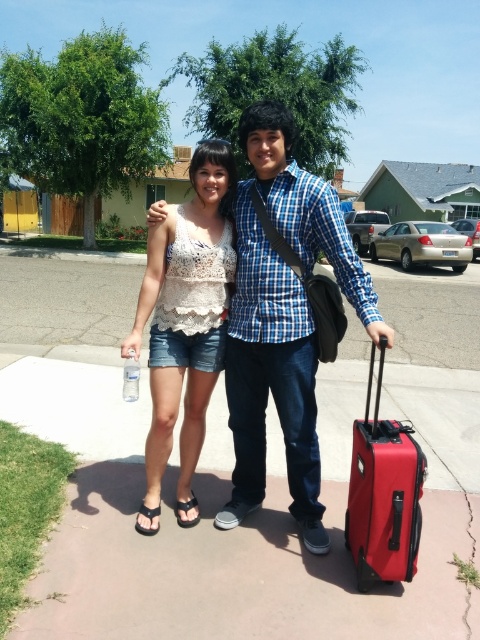
You are a photographer trying to capture a photo of the white lace tank top at center and the black fabric sandal at lower left. Which object should you focus on first if you want to ensure both are in the frame without moving the camera?

The black fabric sandal at lower left should be focused on first because the white lace tank top at center is to the right of it, so adjusting the frame to include the sandal on the left ensures the tank top is also within the shot.

You are a delivery robot with a width of 50 centimeters. You need to move past the clear plastic bottle at lower left and the black fabric sandal at lower left. Can you fit through the space between them?

The space between the clear plastic bottle at lower left and the black fabric sandal at lower left is 64.22 centimeters. Since your width is 50 centimeters, you can fit through the space between them.

Based on the photo, you are standing at the center of the image and want to pick up the red matte suitcase at lower right. In which direction should you move to reach it?

The red matte suitcase at lower right is located at point (384, 493), so you should move to the lower right direction to reach it.